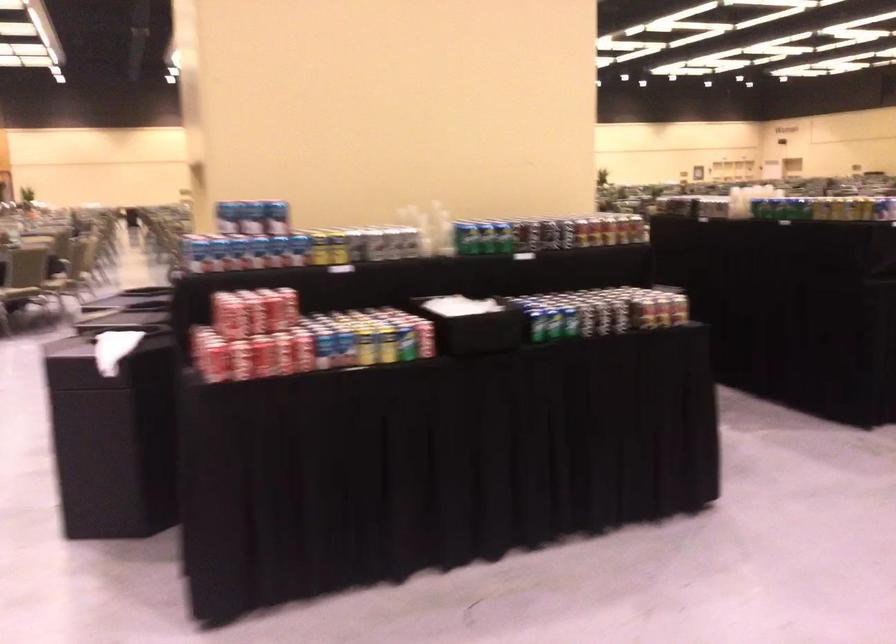
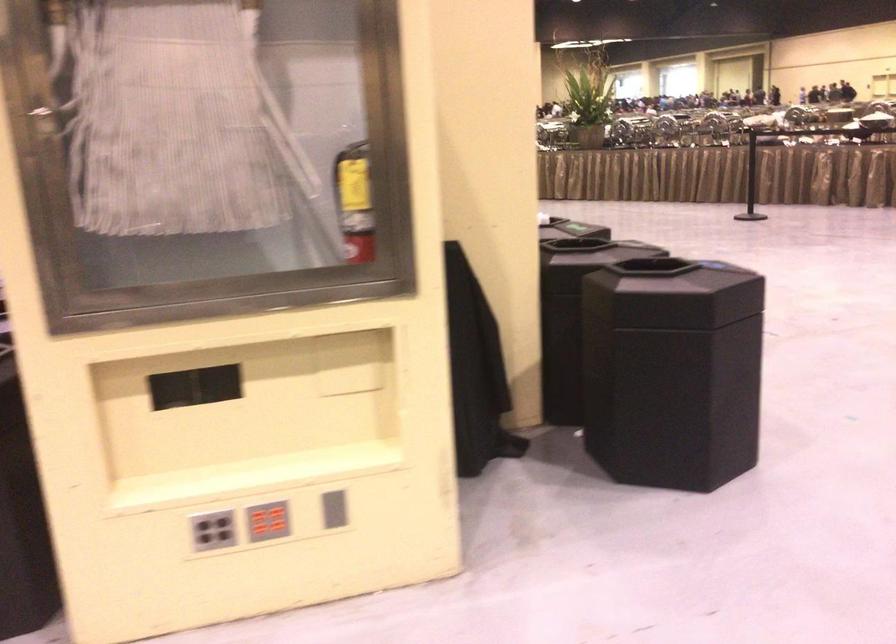
Question: I am providing you with two images of the same scene from different viewpoints. After the viewpoint changes to image2, which objects are now occluded?

Choices:
 (A) grey vertical slot
 (B) black trash can lid
 (C) green soda can
 (D) orange pumpkin object

Answer: (C)